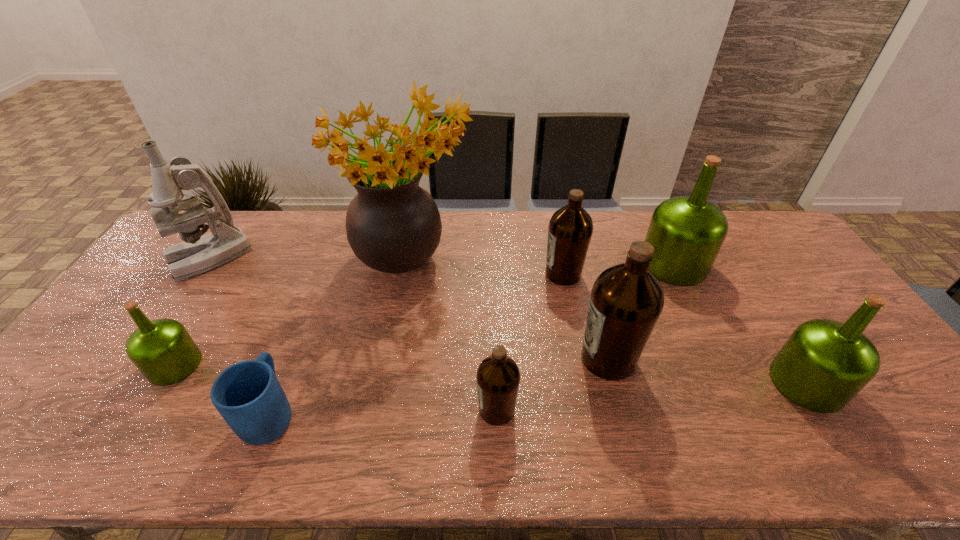
Find the location of a particular element. The height and width of the screenshot is (540, 960). blank area in the image that satisfies the following two spatial constraints: 1. on the front side of the biggest green olive oil; 2. on the label of the leftmost brown olive oil is located at coordinates (744, 410).

This screenshot has height=540, width=960. Identify the location of vacant space that satisfies the following two spatial constraints: 1. on the front side of the biggest green olive oil; 2. on the label of the biggest brown olive oil. (719, 359).

At what (x,y) coordinates should I click in order to perform the action: click on free space that satisfies the following two spatial constraints: 1. on the side of the third object from left to right with the handle; 2. on the left side of the farthest green olive oil. Please return your answer as a coordinate pair (x, y). The width and height of the screenshot is (960, 540). Looking at the image, I should click on (328, 264).